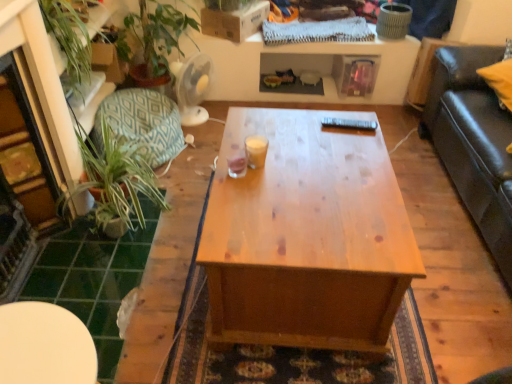
Question: From a real-world perspective, is teal fabric cushion at left beneath translucent glass at center, which appears as the 1th coffee cup when viewed from the left?

Choices:
 (A) yes
 (B) no

Answer: (A)

Question: Considering the relative positions of teal fabric cushion at left and translucent glass at center, which appears as the 1th coffee cup when viewed from the left, in the image provided, is teal fabric cushion at left to the right of translucent glass at center, which appears as the 1th coffee cup when viewed from the left, from the viewer's perspective?

Choices:
 (A) yes
 (B) no

Answer: (B)

Question: Considering the relative sizes of teal fabric cushion at left and translucent glass at center, which appears as the 1th coffee cup when viewed from the left, in the image provided, is teal fabric cushion at left shorter than translucent glass at center, which appears as the 1th coffee cup when viewed from the left,?

Choices:
 (A) no
 (B) yes

Answer: (A)

Question: Is translucent glass at center, which ranks as the second coffee cup in right-to-left order, inside teal fabric cushion at left?

Choices:
 (A) no
 (B) yes

Answer: (A)

Question: Can you confirm if teal fabric cushion at left is positioned to the left of translucent glass at center, which appears as the 1th coffee cup when viewed from the left?

Choices:
 (A) no
 (B) yes

Answer: (B)

Question: Does teal fabric cushion at left lie behind translucent glass at center, which ranks as the second coffee cup in right-to-left order?

Choices:
 (A) no
 (B) yes

Answer: (B)

Question: Is translucent glass cup at center, marked as the 1th coffee cup in a right-to-left arrangement, at the left side of translucent glass at center, which ranks as the second coffee cup in right-to-left order?

Choices:
 (A) no
 (B) yes

Answer: (A)

Question: Is the surface of translucent glass cup at center, marked as the 1th coffee cup in a right-to-left arrangement, in direct contact with translucent glass at center, which appears as the 1th coffee cup when viewed from the left?

Choices:
 (A) no
 (B) yes

Answer: (B)

Question: Can you confirm if translucent glass cup at center, the 2th coffee cup in the left-to-right sequence, is positioned to the right of translucent glass at center, which appears as the 1th coffee cup when viewed from the left?

Choices:
 (A) no
 (B) yes

Answer: (B)

Question: Is translucent glass cup at center, marked as the 1th coffee cup in a right-to-left arrangement, smaller than translucent glass at center, which appears as the 1th coffee cup when viewed from the left?

Choices:
 (A) no
 (B) yes

Answer: (A)

Question: Considering the relative sizes of translucent glass cup at center, the 2th coffee cup in the left-to-right sequence, and translucent glass at center, which ranks as the second coffee cup in right-to-left order, in the image provided, is translucent glass cup at center, the 2th coffee cup in the left-to-right sequence, wider than translucent glass at center, which ranks as the second coffee cup in right-to-left order,?

Choices:
 (A) no
 (B) yes

Answer: (B)

Question: Is translucent glass cup at center, marked as the 1th coffee cup in a right-to-left arrangement, thinner than translucent glass at center, which appears as the 1th coffee cup when viewed from the left?

Choices:
 (A) yes
 (B) no

Answer: (B)

Question: Is white glossy table at lower left in contact with translucent glass at center, which appears as the 1th coffee cup when viewed from the left?

Choices:
 (A) no
 (B) yes

Answer: (A)